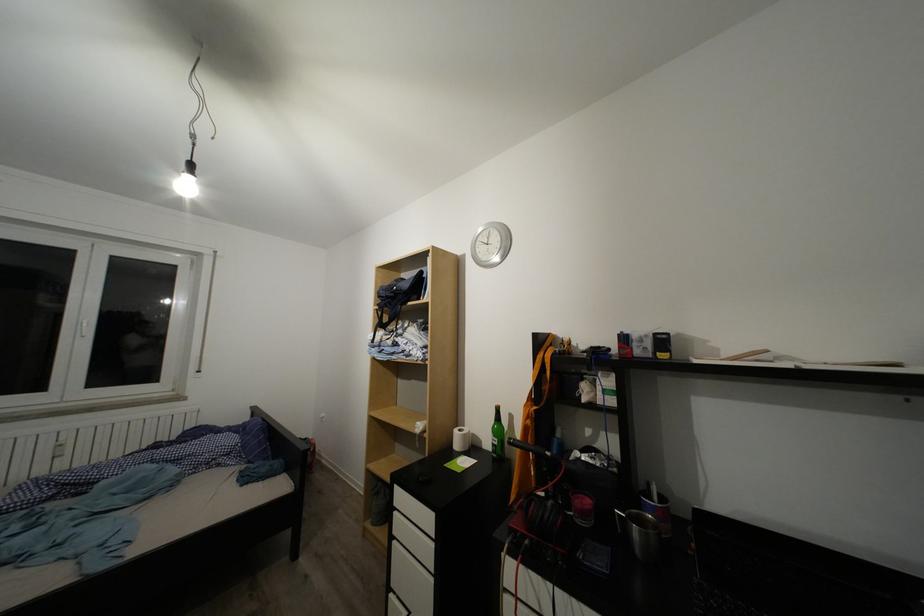
Where would you pull the white drawer pull? Please return your answer as a coordinate pair (x, y).

(420, 519)